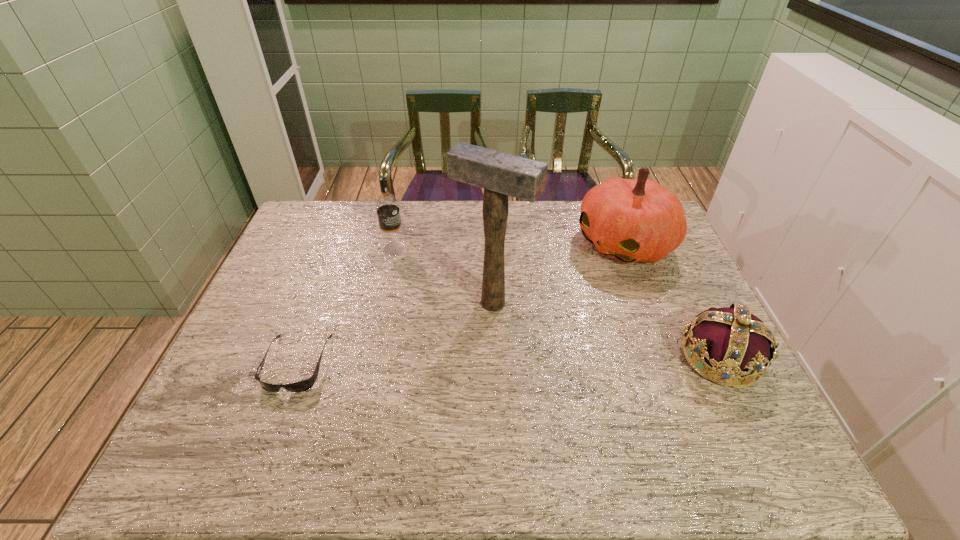
Locate an element on the screen. This screenshot has width=960, height=540. vacant space situated on the front-facing side of the pumpkin is located at coordinates pyautogui.click(x=513, y=318).

Locate an element on the screen. This screenshot has height=540, width=960. vacant space located on the front-facing side of the pumpkin is located at coordinates (567, 281).

Where is `free location located on the label of the vodka`? This screenshot has height=540, width=960. free location located on the label of the vodka is located at coordinates (441, 294).

The image size is (960, 540). I want to click on free location located 0.350m on the label of the vodka, so click(466, 318).

Where is `blank space located on the label of the vodka`? blank space located on the label of the vodka is located at coordinates (416, 269).

Where is `free space located on the striking surface of the third object from right to left`? This screenshot has height=540, width=960. free space located on the striking surface of the third object from right to left is located at coordinates (457, 343).

Image resolution: width=960 pixels, height=540 pixels. I want to click on vacant space located 0.200m on the striking surface of the third object from right to left, so click(434, 374).

I want to click on vacant space located on the striking surface of the third object from right to left, so click(449, 354).

Where is `pumpkin that is at the far edge`? This screenshot has height=540, width=960. pumpkin that is at the far edge is located at coordinates (633, 220).

Find the location of `vodka that is at the far edge`. vodka that is at the far edge is located at coordinates (387, 207).